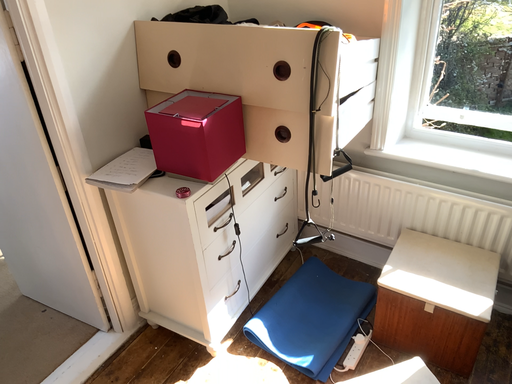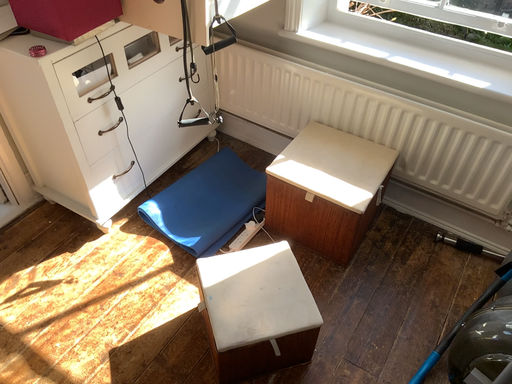
Question: How did the camera likely rotate when shooting the video?

Choices:
 (A) rotated downward
 (B) rotated upward

Answer: (A)